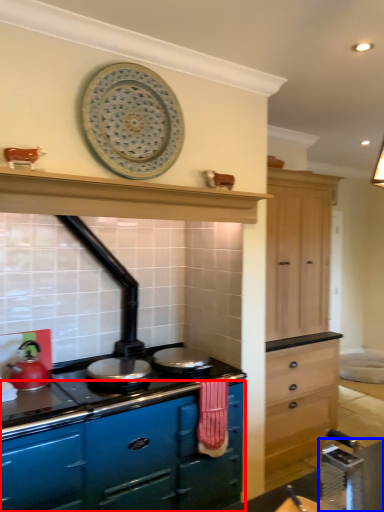
Question: Which of the following is the farthest to the observer, cabinetry (highlighted by a red box) or table (highlighted by a blue box)?

Choices:
 (A) cabinetry
 (B) table

Answer: (A)